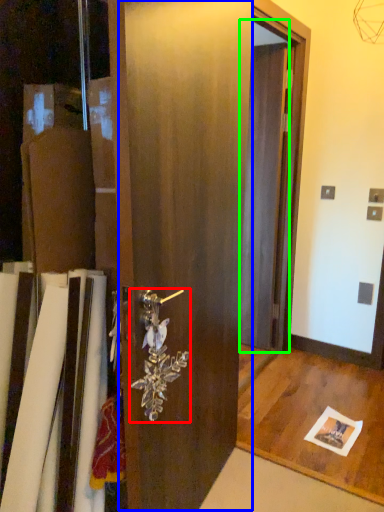
Question: Which object is positioned farthest from door handle (highlighted by a red box)? Select from barn door (highlighted by a blue box) and screen door (highlighted by a green box).

Choices:
 (A) barn door
 (B) screen door

Answer: (B)